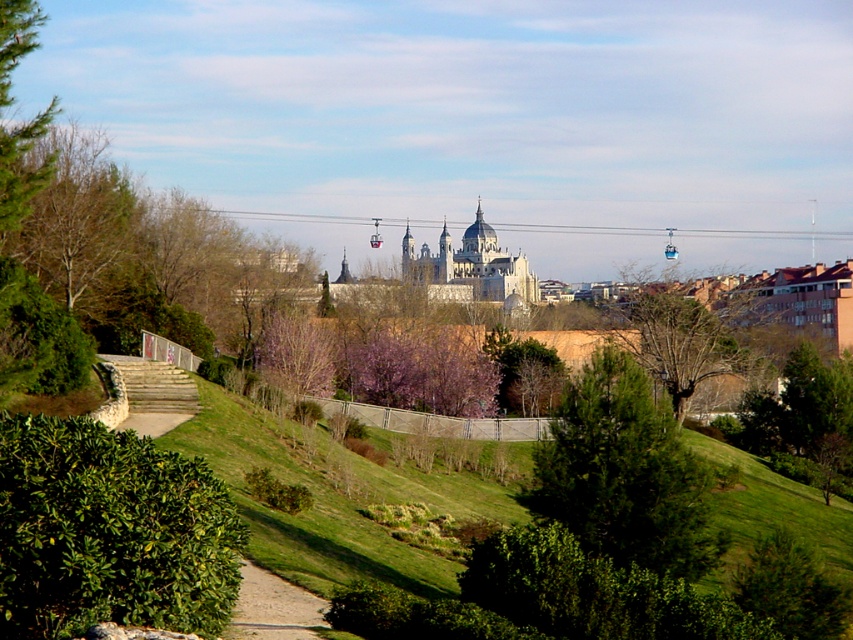
You are planning to take a photo of the white stone castle at center and the pink textured tree at center from a position where both are visible. Based on their widths, which object would require you to stand closer to capture both in frame without zooming?

The white stone castle at center might be wider than the pink textured tree at center, so you might need to stand closer to the castle to ensure both fit in the frame without zooming.

You are standing at the point with coordinates point [96,426] and want to walk towards the point with coordinates point [257,620]. Will you be moving towards the Almudena Cathedral or away from it?

Since point [96,426] is in front of point [257,620], moving from point [96,426] towards point [257,620] means you are moving away from the Almudena Cathedral.